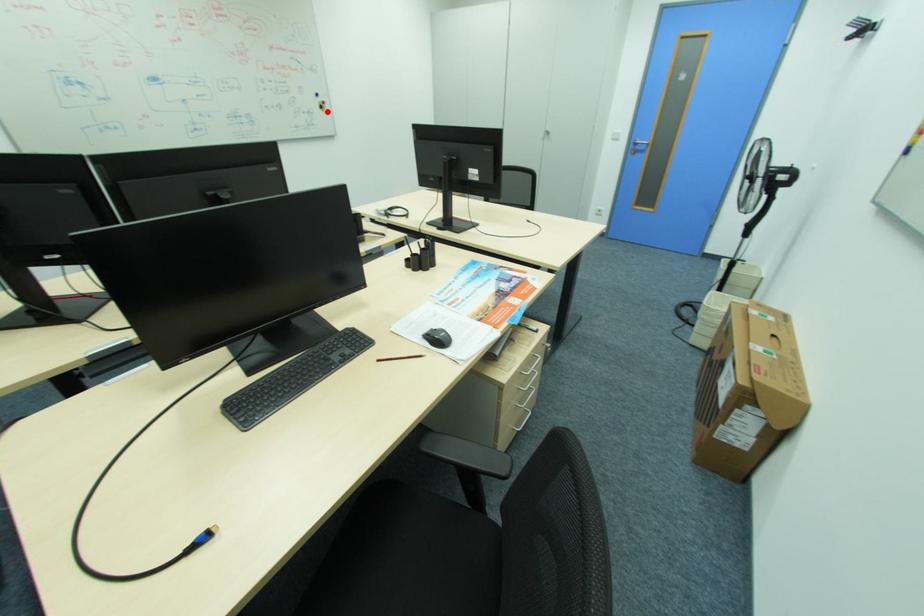
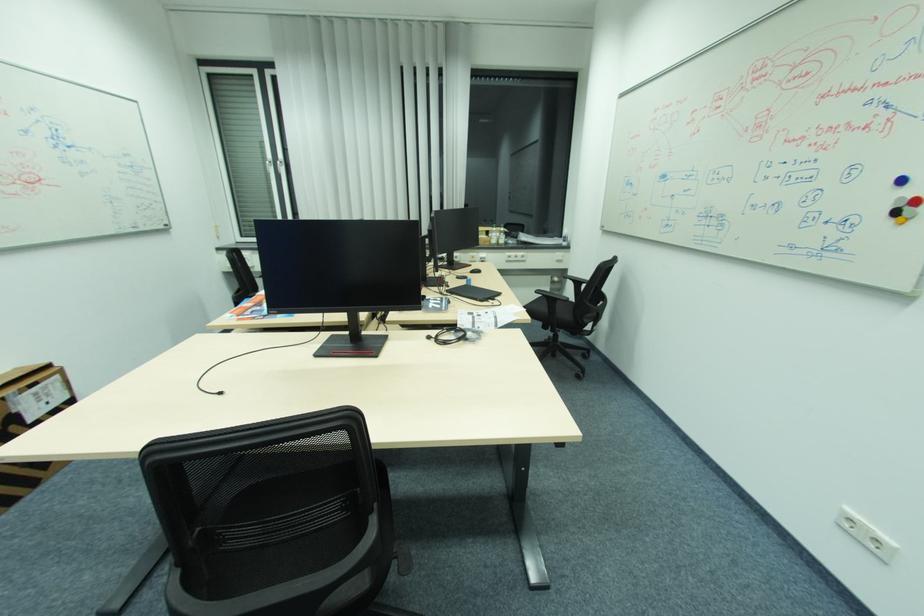
Locate, in the second image, the point that corresponds to the highlighted location in the first image.

(896, 221)